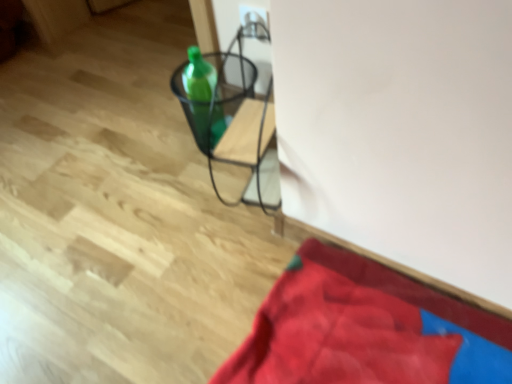
The image size is (512, 384). In order to click on free space above velvety red blanket at lower right (from a real-world perspective) in this screenshot , I will do `click(359, 323)`.